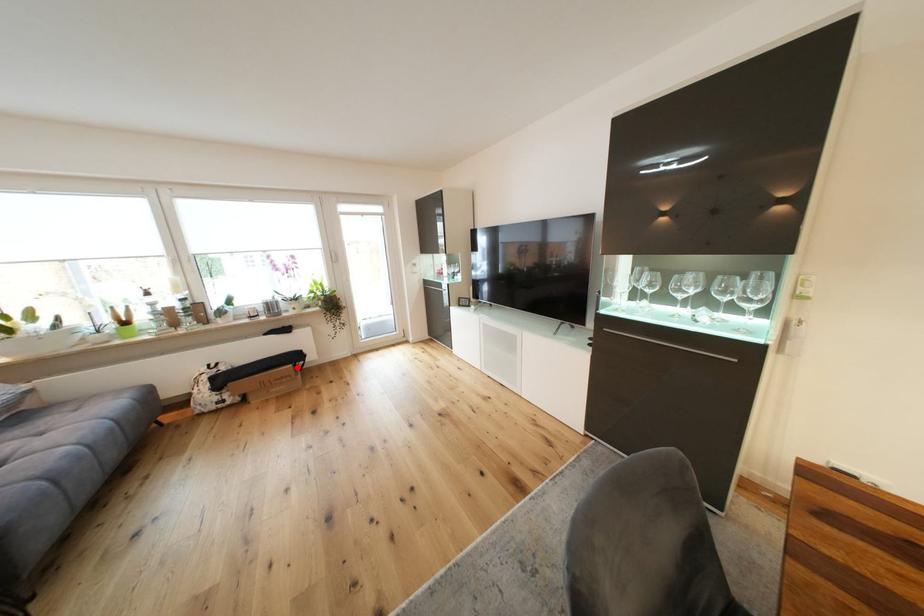
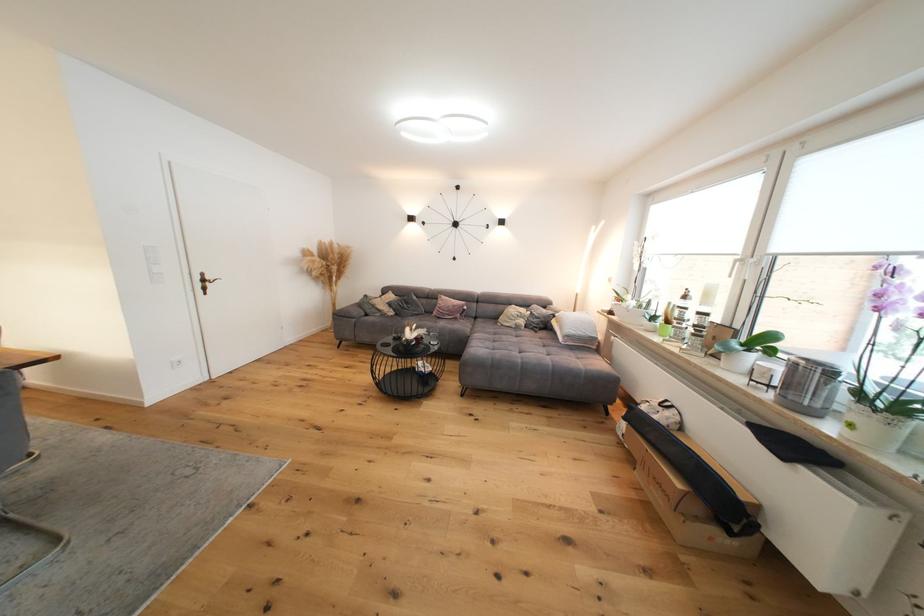
Question: I am providing you with two images of the same scene from different viewpoints. Image1 has a red point marked. In image2, the corresponding 3D location appears at what relative position? Reply with the corresponding letter.

Choices:
 (A) Closer
 (B) Farther

Answer: (B)